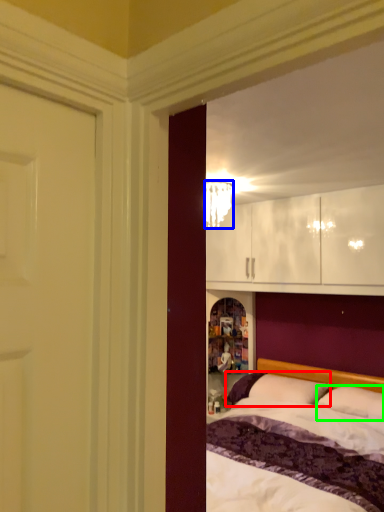
Question: Considering the real-world distances, which object is farthest from pillow (highlighted by a red box)? lamp (highlighted by a blue box) or pillow (highlighted by a green box)?

Choices:
 (A) lamp
 (B) pillow

Answer: (A)